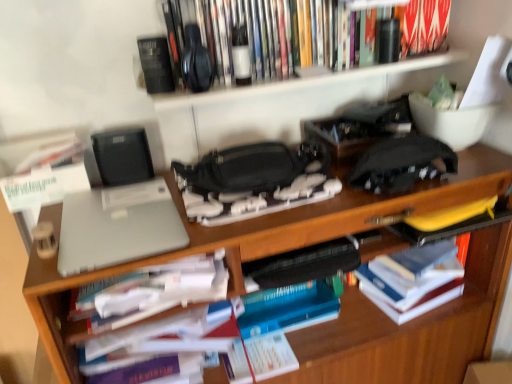
Identify the location of vacant area on top of hardcover book at right, the 1th book ordered from the bottom (from a real-world perspective). The height and width of the screenshot is (384, 512). (420, 258).